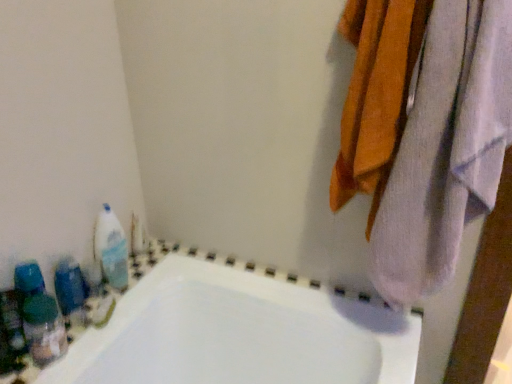
The image size is (512, 384). What are the coordinates of `blue plastic bottles at left` in the screenshot? It's located at (69, 286).

Identify the location of white soft towel at upper right. (446, 149).

What do you see at coordinates (39, 316) in the screenshot? I see `translucent plastic bottles at left, arranged as the first cleaning product when viewed from the front` at bounding box center [39, 316].

I want to click on translucent plastic bottles at left, the second cleaning product in the top-to-bottom sequence, so click(39, 316).

How much space does white glossy bottle at left, marked as the 1th cleaning product in a back-to-front arrangement, occupy horizontally?

white glossy bottle at left, marked as the 1th cleaning product in a back-to-front arrangement, is 5.47 centimeters wide.

You are a GUI agent. You are given a task and a screenshot of the screen. Output one action in this format:
    pyautogui.click(x=<x>, y=<y>)
    Task: Click on the white glossy bottle at left, marked as the 1th cleaning product in a back-to-front arrangement
    The image size is (512, 384).
    Given the screenshot: What is the action you would take?
    pyautogui.click(x=111, y=249)

This screenshot has height=384, width=512. What are the coordinates of `blue plastic bottles at left` in the screenshot? It's located at (69, 286).

Between white glossy bottle at left, placed as the first cleaning product when sorted from top to bottom, and blue plastic bottles at left, which one has larger size?

white glossy bottle at left, placed as the first cleaning product when sorted from top to bottom.

Would you consider white glossy bottle at left, marked as the 1th cleaning product in a back-to-front arrangement, to be distant from blue plastic bottles at left?

Actually, white glossy bottle at left, marked as the 1th cleaning product in a back-to-front arrangement, and blue plastic bottles at left are a little close together.

Looking at this image, does white glossy bottle at left, arranged as the second cleaning product when viewed from the front, turn towards blue plastic bottles at left?

No, white glossy bottle at left, arranged as the second cleaning product when viewed from the front, is not turned towards blue plastic bottles at left.

How distant is white glossy bottle at left, arranged as the second cleaning product when viewed from the front, from blue plastic bottles at left?

A distance of 4.21 inches exists between white glossy bottle at left, arranged as the second cleaning product when viewed from the front, and blue plastic bottles at left.

Considering the sizes of objects blue plastic bottles at left and translucent plastic bottles at left, arranged as the first cleaning product when viewed from the front, in the image provided, who is thinner, blue plastic bottles at left or translucent plastic bottles at left, arranged as the first cleaning product when viewed from the front,?

blue plastic bottles at left is thinner.

What's the angular difference between blue plastic bottles at left and translucent plastic bottles at left, which ranks as the first cleaning product in bottom-to-top order,'s facing directions?

0.00111 degrees separate the facing orientations of blue plastic bottles at left and translucent plastic bottles at left, which ranks as the first cleaning product in bottom-to-top order.

From the picture: Considering the relative positions of blue plastic bottles at left and translucent plastic bottles at left, which ranks as the first cleaning product in bottom-to-top order, in the image provided, is blue plastic bottles at left to the right of translucent plastic bottles at left, which ranks as the first cleaning product in bottom-to-top order, from the viewer's perspective?

No, blue plastic bottles at left is not to the right of translucent plastic bottles at left, which ranks as the first cleaning product in bottom-to-top order.

From a real-world perspective, does blue plastic bottles at left sit lower than translucent plastic bottles at left, acting as the second cleaning product starting from the back?

Correct, in the physical world, blue plastic bottles at left is lower than translucent plastic bottles at left, acting as the second cleaning product starting from the back.

Looking at this image, is white soft towel at upper right not near white glossy bottle at left, marked as the 1th cleaning product in a back-to-front arrangement?

Actually, white soft towel at upper right and white glossy bottle at left, marked as the 1th cleaning product in a back-to-front arrangement, are a little close together.

How much distance is there between white soft towel at upper right and white glossy bottle at left, marked as the 1th cleaning product in a back-to-front arrangement?

80.26 centimeters.

Does white soft towel at upper right lie behind white glossy bottle at left, the 2th cleaning product positioned from the bottom?

No.

From the image's perspective, is white soft towel at upper right on white glossy bottle at left, placed as the first cleaning product when sorted from top to bottom?

Yes, from the image's perspective, white soft towel at upper right is on top of white glossy bottle at left, placed as the first cleaning product when sorted from top to bottom.

How different are the orientations of blue plastic bottles at left and white soft towel at upper right in degrees?

89.2 degrees.

Is blue plastic bottles at left in contact with white soft towel at upper right?

blue plastic bottles at left and white soft towel at upper right are not in contact.

From the image's perspective, is blue plastic bottles at left beneath white soft towel at upper right?

Yes.

Is point (123, 271) farther from camera compared to point (468, 194)?

Yes, point (123, 271) is behind point (468, 194).

Is white glossy bottle at left, placed as the first cleaning product when sorted from top to bottom, smaller than white soft towel at upper right?

Correct, white glossy bottle at left, placed as the first cleaning product when sorted from top to bottom, occupies less space than white soft towel at upper right.

Is there a large distance between white glossy bottle at left, placed as the first cleaning product when sorted from top to bottom, and white soft towel at upper right?

No, there isn't a large distance between white glossy bottle at left, placed as the first cleaning product when sorted from top to bottom, and white soft towel at upper right.

Is white glossy bottle at left, the 2th cleaning product positioned from the bottom, looking in the opposite direction of white soft towel at upper right?

No.

Is white soft towel at upper right bigger than blue plastic bottles at left?

Yes.

From the picture: Is white soft towel at upper right further to the viewer compared to blue plastic bottles at left?

No, white soft towel at upper right is closer to the camera.

From a real-world perspective, which is physically below, white soft towel at upper right or blue plastic bottles at left?

blue plastic bottles at left, from a real-world perspective.

Can you confirm if translucent plastic bottles at left, the second cleaning product in the top-to-bottom sequence, is taller than white soft towel at upper right?

In fact, translucent plastic bottles at left, the second cleaning product in the top-to-bottom sequence, may be shorter than white soft towel at upper right.

Does translucent plastic bottles at left, acting as the second cleaning product starting from the back, turn towards white soft towel at upper right?

No, translucent plastic bottles at left, acting as the second cleaning product starting from the back, is not aimed at white soft towel at upper right.

From a real-world perspective, is translucent plastic bottles at left, the second cleaning product in the top-to-bottom sequence, physically located above or below white soft towel at upper right?

Clearly, from a real-world perspective, translucent plastic bottles at left, the second cleaning product in the top-to-bottom sequence, is below white soft towel at upper right.

How distant is translucent plastic bottles at left, arranged as the first cleaning product when viewed from the front, from white soft towel at upper right?

translucent plastic bottles at left, arranged as the first cleaning product when viewed from the front, is 32.07 inches away from white soft towel at upper right.

Where is `cleaning product that is above the blue plastic bottles at left (from the image's perspective)`? cleaning product that is above the blue plastic bottles at left (from the image's perspective) is located at coordinates (111, 249).

What are the coordinates of `toiletry located behind the translucent plastic bottles at left, the second cleaning product in the top-to-bottom sequence` in the screenshot? It's located at (69, 286).

When comparing their distances from white soft towel at upper right, does translucent plastic bottles at left, which ranks as the first cleaning product in bottom-to-top order, or white glossy bottle at left, placed as the first cleaning product when sorted from top to bottom, seem closer?

white glossy bottle at left, placed as the first cleaning product when sorted from top to bottom.

From the image, which object appears to be nearer to blue plastic bottles at left, white soft towel at upper right or white glossy bottle at left, marked as the 1th cleaning product in a back-to-front arrangement?

Among the two, white glossy bottle at left, marked as the 1th cleaning product in a back-to-front arrangement, is located nearer to blue plastic bottles at left.

Estimate the real-world distances between objects in this image. Which object is closer to white soft towel at upper right, white glossy bottle at left, the 2th cleaning product positioned from the bottom, or translucent plastic bottles at left, which ranks as the first cleaning product in bottom-to-top order?

Based on the image, white glossy bottle at left, the 2th cleaning product positioned from the bottom, appears to be nearer to white soft towel at upper right.

From the image, which object appears to be nearer to translucent plastic bottles at left, the second cleaning product in the top-to-bottom sequence, white glossy bottle at left, placed as the first cleaning product when sorted from top to bottom, or white soft towel at upper right?

white glossy bottle at left, placed as the first cleaning product when sorted from top to bottom, is positioned closer to the anchor translucent plastic bottles at left, the second cleaning product in the top-to-bottom sequence.

Estimate the real-world distances between objects in this image. Which object is closer to blue plastic bottles at left, translucent plastic bottles at left, the second cleaning product in the top-to-bottom sequence, or white glossy bottle at left, marked as the 1th cleaning product in a back-to-front arrangement?

Among the two, translucent plastic bottles at left, the second cleaning product in the top-to-bottom sequence, is located nearer to blue plastic bottles at left.

From the image, which object appears to be nearer to blue plastic bottles at left, white soft towel at upper right or translucent plastic bottles at left, which ranks as the first cleaning product in bottom-to-top order?

translucent plastic bottles at left, which ranks as the first cleaning product in bottom-to-top order, is closer to blue plastic bottles at left.

Which object lies nearer to the anchor point blue plastic bottles at left, white glossy bottle at left, placed as the first cleaning product when sorted from top to bottom, or translucent plastic bottles at left, arranged as the first cleaning product when viewed from the front?

translucent plastic bottles at left, arranged as the first cleaning product when viewed from the front.

From the image, which object appears to be nearer to white glossy bottle at left, the 2th cleaning product positioned from the bottom, translucent plastic bottles at left, the second cleaning product in the top-to-bottom sequence, or blue plastic bottles at left?

blue plastic bottles at left is positioned closer to the anchor white glossy bottle at left, the 2th cleaning product positioned from the bottom.

The height and width of the screenshot is (384, 512). In order to click on cleaning product between translucent plastic bottles at left, the second cleaning product in the top-to-bottom sequence, and white soft towel at upper right in this screenshot , I will do coord(111,249).

The height and width of the screenshot is (384, 512). Find the location of `toiletry between translucent plastic bottles at left, which ranks as the first cleaning product in bottom-to-top order, and white glossy bottle at left, arranged as the second cleaning product when viewed from the front, in the front-back direction`. toiletry between translucent plastic bottles at left, which ranks as the first cleaning product in bottom-to-top order, and white glossy bottle at left, arranged as the second cleaning product when viewed from the front, in the front-back direction is located at coordinates (69, 286).